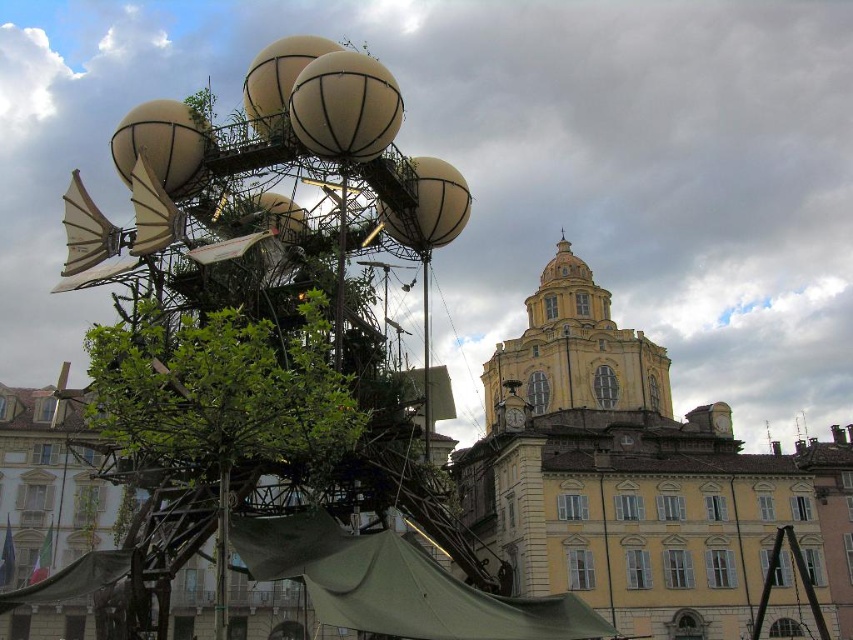
You are standing in the middle of the image. Which direction should you move to reach the green leafy tree at center?

The green leafy tree at center is located at coordinates approximately 0.662 on the x axis and 0.251 on the y axis. Since you are at the center of the image, which is at coordinates approximately 0.5 on both axes, you should move northeast to reach it.

You are an architect designing a new sculpture garden. You have two elements to place in the garden, the yellow matte tower at upper center and the green canvas canopy at lower left. Based on their sizes, which one should you place in a central elevated position to be the focal point?

The yellow matte tower at upper center should be placed in the central elevated position as the focal point because it is taller than the green canvas canopy at lower left.